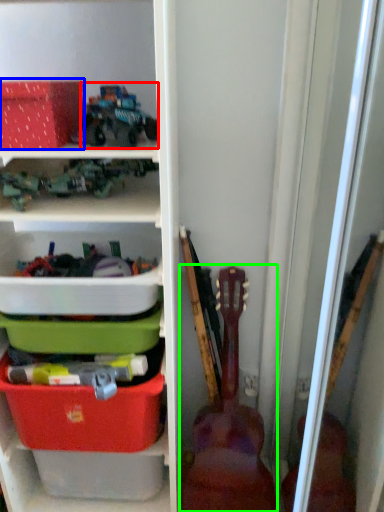
Question: Which object is the closest to the toy (highlighted by a red box)? Choose among these: storage box (highlighted by a blue box) or guitar (highlighted by a green box).

Choices:
 (A) storage box
 (B) guitar

Answer: (A)